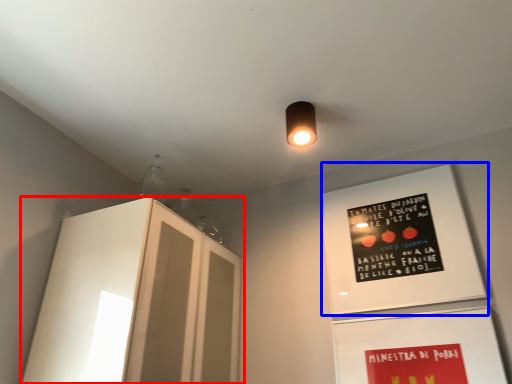
Question: Which of the following is the farthest to the observer, cabinetry (highlighted by a red box) or bulletin board (highlighted by a blue box)?

Choices:
 (A) cabinetry
 (B) bulletin board

Answer: (B)